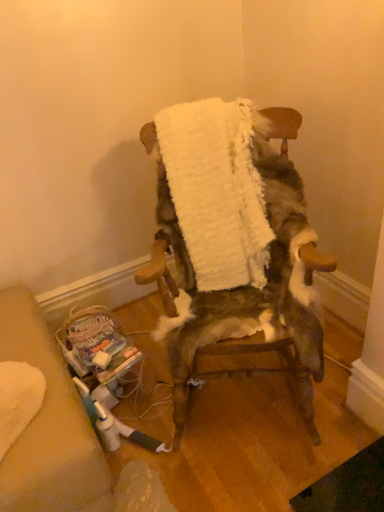
You are a GUI agent. You are given a task and a screenshot of the screen. Output one action in this format:
    pyautogui.click(x=<x>, y=<y>)
    Task: Click on the white fluffy blanket at center
    
    Given the screenshot: What is the action you would take?
    pyautogui.click(x=216, y=190)

Describe the element at coordinates (216, 190) in the screenshot. This screenshot has width=384, height=512. I see `white fluffy blanket at center` at that location.

What is the approximate width of white fluffy blanket at center?

15.90 inches.

Image resolution: width=384 pixels, height=512 pixels. I want to click on wooden rocking chair at center, so click(x=248, y=285).

This screenshot has height=512, width=384. What do you see at coordinates (248, 285) in the screenshot?
I see `wooden rocking chair at center` at bounding box center [248, 285].

You are a GUI agent. You are given a task and a screenshot of the screen. Output one action in this format:
    pyautogui.click(x=<x>, y=<y>)
    Task: Click on the white fluffy blanket at center
    The height and width of the screenshot is (512, 384).
    Given the screenshot: What is the action you would take?
    pyautogui.click(x=216, y=190)

Between wooden rocking chair at center and white fluffy blanket at center, which one appears on the right side from the viewer's perspective?

wooden rocking chair at center is more to the right.

Does wooden rocking chair at center lie behind white fluffy blanket at center?

No, wooden rocking chair at center is closer to the camera.

Which is nearer, (290, 276) or (167, 150)?

Point (290, 276) appears to be closer to the viewer than point (167, 150).

From the image's perspective, is wooden rocking chair at center beneath white fluffy blanket at center?

Yes, from the image's perspective, wooden rocking chair at center is beneath white fluffy blanket at center.

In the scene shown: From a real-world perspective, is wooden rocking chair at center beneath white fluffy blanket at center?

Yes, from a real-world perspective, wooden rocking chair at center is below white fluffy blanket at center.

In the scene shown: Which object is thinner, wooden rocking chair at center or white fluffy blanket at center?

With smaller width is white fluffy blanket at center.

Which of these two, wooden rocking chair at center or white fluffy blanket at center, stands taller?

wooden rocking chair at center is taller.

In the scene shown: Who is bigger, wooden rocking chair at center or white fluffy blanket at center?

wooden rocking chair at center is bigger.

Do you think wooden rocking chair at center is within white fluffy blanket at center, or outside of it?

wooden rocking chair at center is spatially situated outside white fluffy blanket at center.

Is there a large distance between wooden rocking chair at center and white fluffy blanket at center?

No, wooden rocking chair at center is not far away from white fluffy blanket at center.

Is wooden rocking chair at center looking in the opposite direction of white fluffy blanket at center?

Absolutely, wooden rocking chair at center is directed away from white fluffy blanket at center.

Locate an element on the screen. The height and width of the screenshot is (512, 384). blanket that appears behind the wooden rocking chair at center is located at coordinates (216, 190).

Considering the relative positions of white fluffy blanket at center and wooden rocking chair at center in the image provided, is white fluffy blanket at center to the left of wooden rocking chair at center from the viewer's perspective?

Yes.

Which object is further away from the camera, white fluffy blanket at center or wooden rocking chair at center?

white fluffy blanket at center is further away from the camera.

Which is less distant, [240,241] or [272,216]?

Point [240,241] appears to be farther away from the viewer than point [272,216].

From the image's perspective, is white fluffy blanket at center located above wooden rocking chair at center?

Yes, from the image's perspective, white fluffy blanket at center is over wooden rocking chair at center.

From a real-world perspective, between white fluffy blanket at center and wooden rocking chair at center, who is vertically higher?

white fluffy blanket at center, from a real-world perspective.

Does white fluffy blanket at center have a greater width compared to wooden rocking chair at center?

No, white fluffy blanket at center is not wider than wooden rocking chair at center.

Can you confirm if white fluffy blanket at center is shorter than wooden rocking chair at center?

Yes.

Which of these two, white fluffy blanket at center or wooden rocking chair at center, is bigger?

Bigger between the two is wooden rocking chair at center.

Could wooden rocking chair at center be considered to be inside white fluffy blanket at center?

Definitely not — wooden rocking chair at center is not inside white fluffy blanket at center.

Are white fluffy blanket at center and wooden rocking chair at center beside each other?

white fluffy blanket at center and wooden rocking chair at center are not in contact.

Is white fluffy blanket at center oriented away from wooden rocking chair at center?

Yes, wooden rocking chair at center is at the back of white fluffy blanket at center.

Can you tell me how much white fluffy blanket at center and wooden rocking chair at center differ in facing direction?

There is a 2.82-degree angle between the facing directions of white fluffy blanket at center and wooden rocking chair at center.

Identify the location of chair located on the right of white fluffy blanket at center. (248, 285).

Image resolution: width=384 pixels, height=512 pixels. I want to click on blanket above the wooden rocking chair at center (from the image's perspective), so click(x=216, y=190).

Image resolution: width=384 pixels, height=512 pixels. I want to click on chair in front of the white fluffy blanket at center, so click(x=248, y=285).